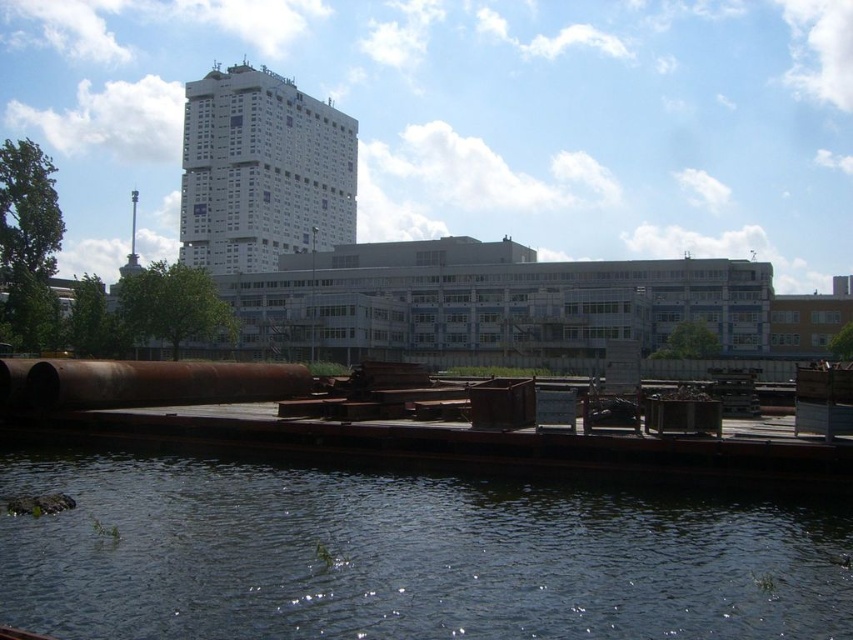
Question: Does dark blue water at lower center have a lesser width compared to rusty metal pipe at lower center?

Choices:
 (A) yes
 (B) no

Answer: (B)

Question: Which point is farther to the camera?

Choices:
 (A) (395, 483)
 (B) (279, 396)

Answer: (B)

Question: Does dark blue water at lower center lie in front of rusty metal pipe at lower center?

Choices:
 (A) no
 (B) yes

Answer: (B)

Question: Is dark blue water at lower center positioned at the back of rusty metal pipe at lower center?

Choices:
 (A) no
 (B) yes

Answer: (A)

Question: Among these objects, which one is nearest to the camera?

Choices:
 (A) dark blue water at lower center
 (B) rusty metal pipe at lower center

Answer: (A)

Question: Which point appears closest to the camera in this image?

Choices:
 (A) (231, 376)
 (B) (569, 557)

Answer: (B)